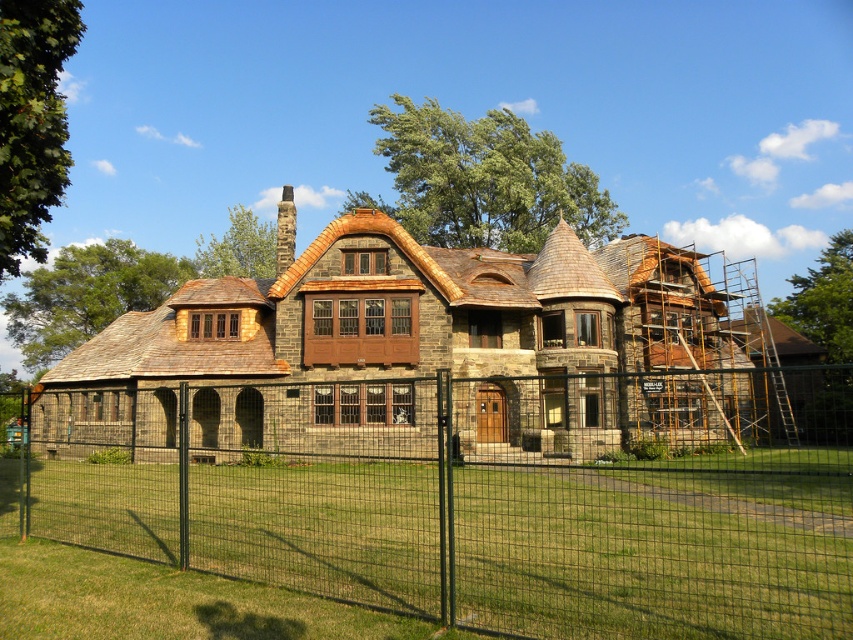
Does green wire mesh fence at center have a lesser height compared to stone house at center?

Indeed, green wire mesh fence at center has a lesser height compared to stone house at center.

Who is more forward, (178, 481) or (444, 296)?

Point (178, 481) is in front.

Which is in front, point (90, 484) or point (744, 358)?

Point (90, 484) is more forward.

Find the location of a particular element. The height and width of the screenshot is (640, 853). green wire mesh fence at center is located at coordinates (480, 493).